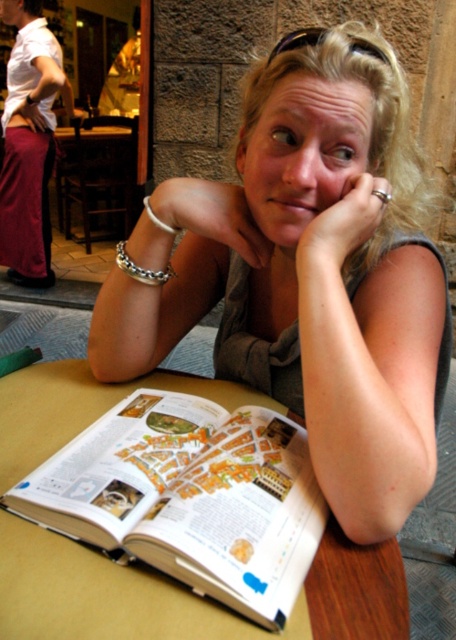
Does matte gray shirt at center lie in front of silver metallic bracelet at left?

Yes, it is.

Identify the location of matte gray shirt at center. The height and width of the screenshot is (640, 456). (309, 273).

You are a GUI agent. You are given a task and a screenshot of the screen. Output one action in this format:
    pyautogui.click(x=<x>, y=<y>)
    Task: Click on the matte gray shirt at center
    
    Given the screenshot: What is the action you would take?
    pyautogui.click(x=309, y=273)

You are a GUI agent. You are given a task and a screenshot of the screen. Output one action in this format:
    pyautogui.click(x=<x>, y=<y>)
    Task: Click on the matte gray shirt at center
    
    Given the screenshot: What is the action you would take?
    pyautogui.click(x=309, y=273)

Is the position of white paper book at center more distant than that of silver metallic bracelet at left?

No.

Does white paper book at center lie in front of silver metallic bracelet at left?

Yes, it is in front of silver metallic bracelet at left.

Identify the location of white paper book at center. The height and width of the screenshot is (640, 456). (188, 497).

This screenshot has height=640, width=456. Identify the location of white paper book at center. (188, 497).

Is point (202, 445) more distant than point (145, 211)?

No, (202, 445) is closer to viewer.

Is point (143, 550) less distant than point (154, 216)?

Yes, it is.

Where is `white paper book at center`? The width and height of the screenshot is (456, 640). white paper book at center is located at coordinates (188, 497).